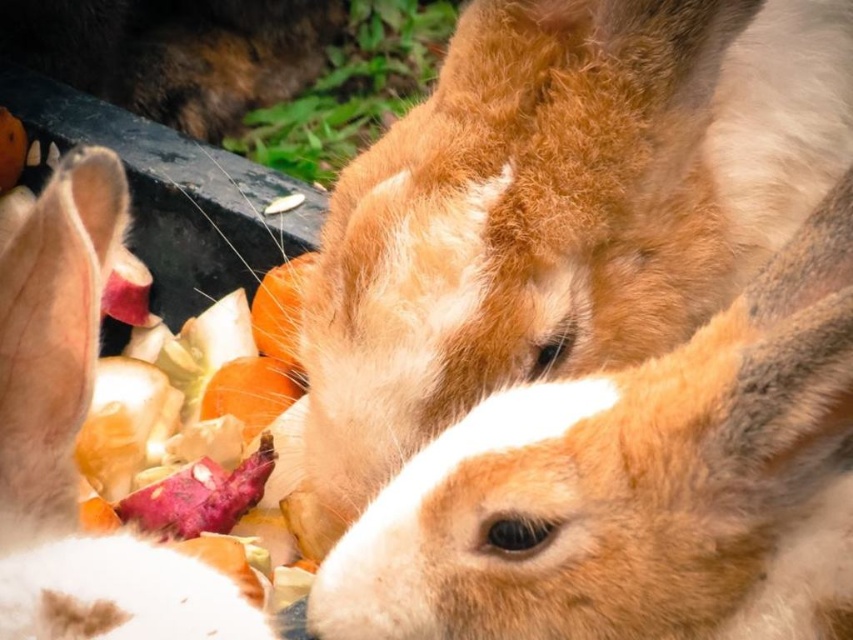
Question: Among these points, which one is nearest to the camera?

Choices:
 (A) (71, 253)
 (B) (549, 483)

Answer: (A)

Question: Is fuzzy brown rabbit at center to the right of white fur rabbit at left from the viewer's perspective?

Choices:
 (A) no
 (B) yes

Answer: (B)

Question: Which object is closer to the camera taking this photo?

Choices:
 (A) white fur rabbit at left
 (B) fuzzy brown rabbit at center

Answer: (A)

Question: Which point is closer to the camera?

Choices:
 (A) white fur rabbit at left
 (B) fuzzy brown rabbit at center

Answer: (A)

Question: From the image, what is the correct spatial relationship of fuzzy brown rabbit at center in relation to white fur rabbit at left?

Choices:
 (A) right
 (B) left

Answer: (A)

Question: Can you confirm if fuzzy brown rabbit at center is positioned to the left of white fur rabbit at left?

Choices:
 (A) yes
 (B) no

Answer: (B)